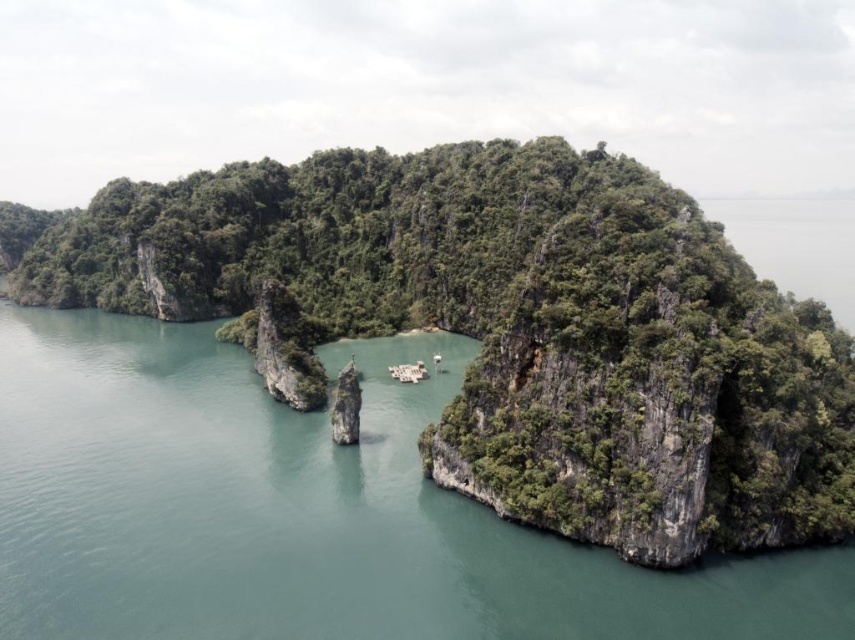
Is green leafy vegetation at center bigger than smooth gray rock at center?

Yes.

Between green leafy vegetation at center and smooth gray rock at center, which one has less height?

Standing shorter between the two is smooth gray rock at center.

Is point (598, 541) positioned behind point (346, 396)?

No, (598, 541) is closer to viewer.

Locate an element on the screen. This screenshot has width=855, height=640. green leafy vegetation at center is located at coordinates (504, 326).